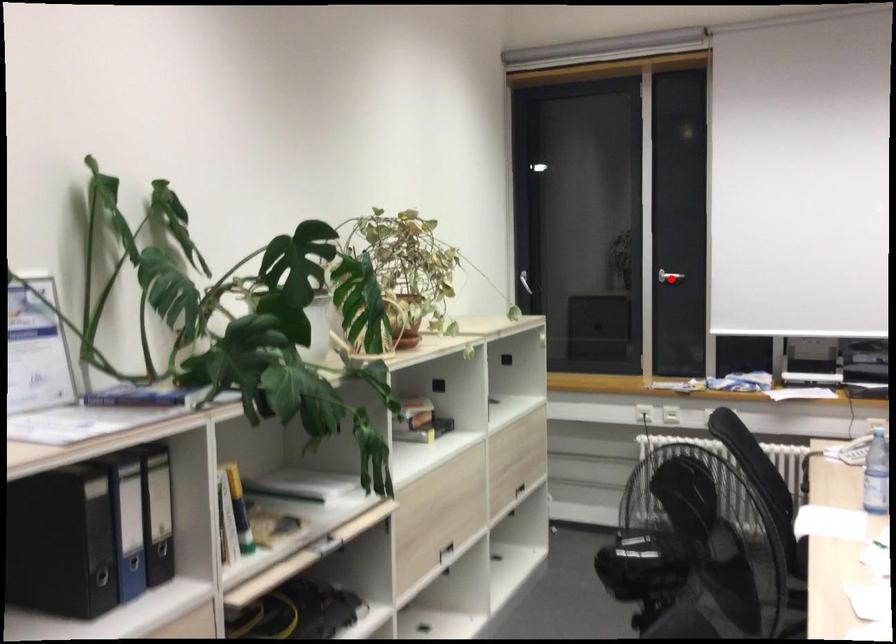
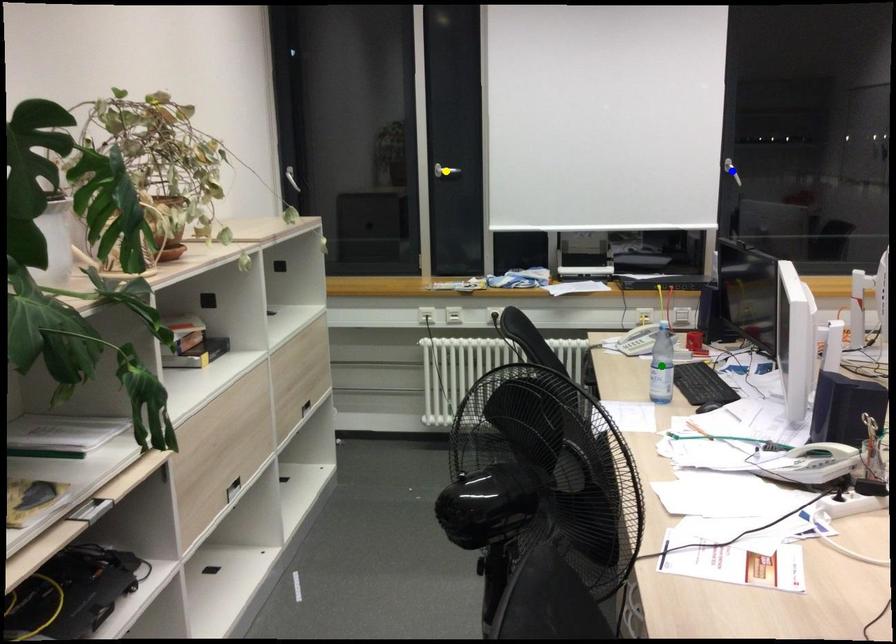
Question: I am providing you with two images of the same scene from different viewpoints. A red point is marked on the first image. You are given multiple points on the second image. In image 2, which mark is for the same physical point as the one in image 1?

Choices:
 (A) green point
 (B) yellow point
 (C) blue point

Answer: (B)